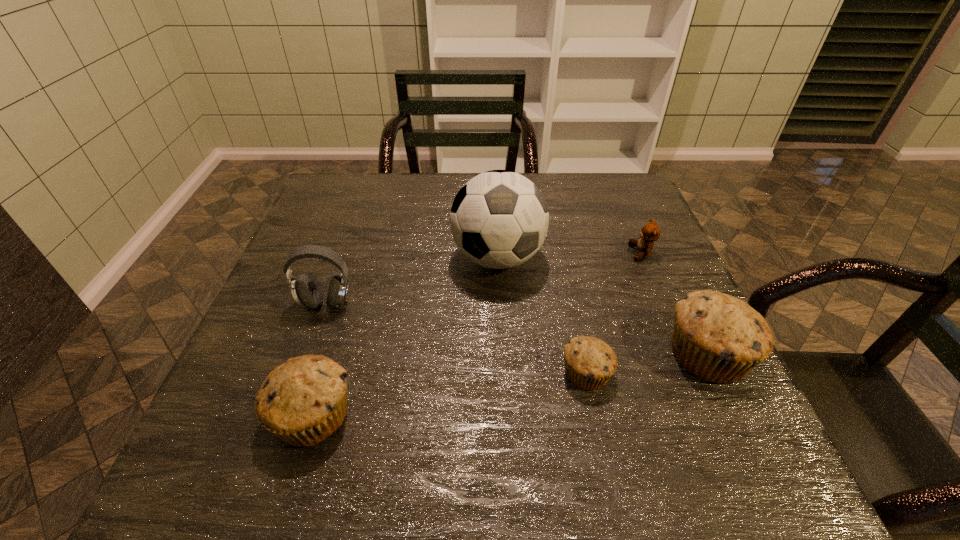
To ensure equal spacing by inserting another muffin among them, please point out a vacant spot for this new muffin. Please provide its 2D coordinates. Your answer should be formatted as a tuple, i.e. [(x, y)], where the tuple contains the x and y coordinates of a point satisfying the conditions above.

[(455, 393)]